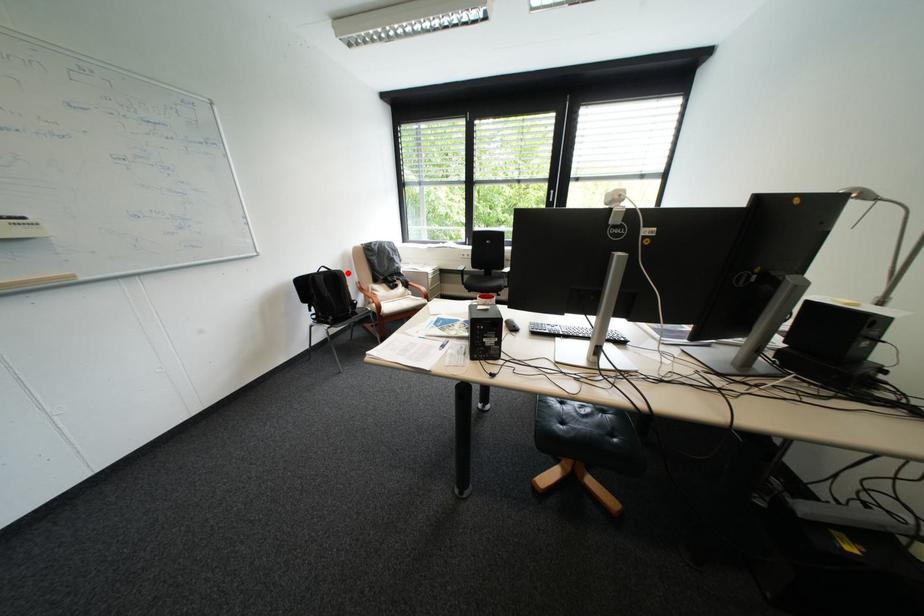
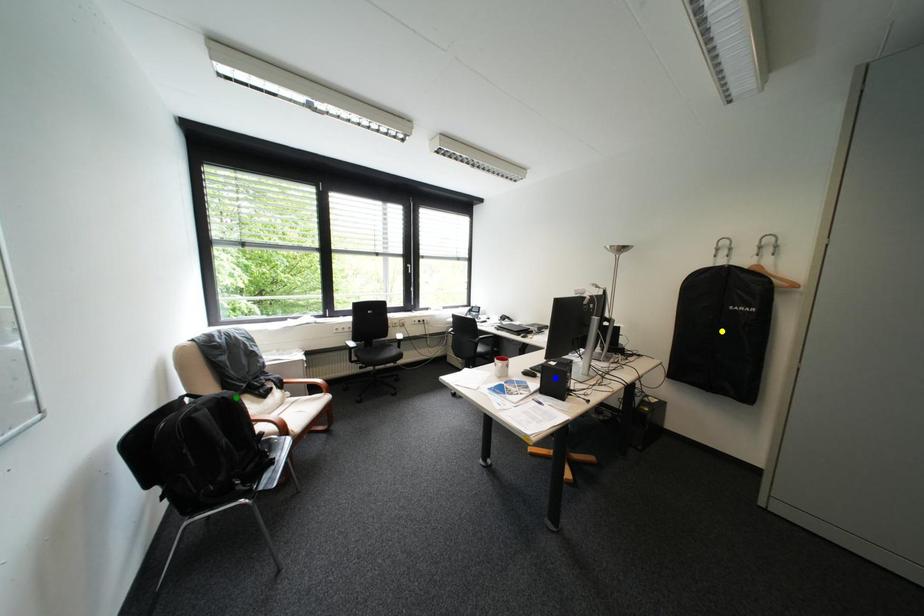
Question: I am providing you with two images of the same scene from different viewpoints. A red point is marked on the first image. You are given multiple points on the second image. Which point in image 2 represents the same 3d spot as the red point in image 1?

Choices:
 (A) yellow point
 (B) blue point
 (C) green point

Answer: (C)